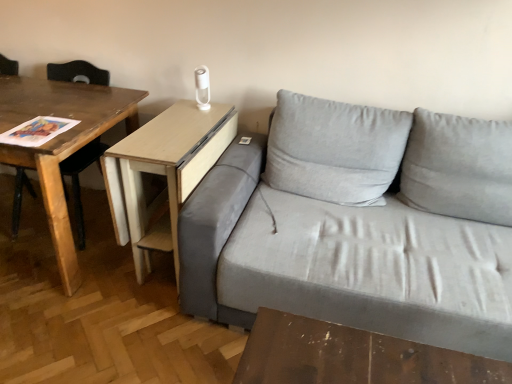
Describe the element at coordinates (163, 173) in the screenshot. Image resolution: width=512 pixels, height=384 pixels. I see `light wood/woodenobject at center, which appears as the second table when viewed from the left` at that location.

Locate an element on the screen. The height and width of the screenshot is (384, 512). gray fabric couch at center is located at coordinates (359, 225).

Where is `light wood/woodenobject at center, which ranks as the first table in right-to-left order`? The height and width of the screenshot is (384, 512). light wood/woodenobject at center, which ranks as the first table in right-to-left order is located at coordinates (163, 173).

Identify the location of studio couch on the right of wooden table at left, which is the 1th table in left-to-right order. (359, 225).

Between wooden table at left, arranged as the 2th table when viewed from the right, and gray fabric couch at center, which one appears on the left side from the viewer's perspective?

From the viewer's perspective, wooden table at left, arranged as the 2th table when viewed from the right, appears more on the left side.

Relative to gray fabric couch at center, is wooden table at left, which is the 1th table in left-to-right order, in front or behind?

wooden table at left, which is the 1th table in left-to-right order, is positioned farther from the viewer than gray fabric couch at center.

Looking at their sizes, would you say wooden table at left, arranged as the 2th table when viewed from the right, is wider or thinner than gray fabric couch at center?

wooden table at left, arranged as the 2th table when viewed from the right, is thinner than gray fabric couch at center.

From the image's perspective, is wooden table at left, which is the 1th table in left-to-right order, located above light wood/woodenobject at center, which appears as the second table when viewed from the left?

Yes, from the image's perspective, wooden table at left, which is the 1th table in left-to-right order, is over light wood/woodenobject at center, which appears as the second table when viewed from the left.

Is wooden table at left, arranged as the 2th table when viewed from the right, outside of light wood/woodenobject at center, which appears as the second table when viewed from the left?

Indeed, wooden table at left, arranged as the 2th table when viewed from the right, is completely outside light wood/woodenobject at center, which appears as the second table when viewed from the left.

Does wooden table at left, which is the 1th table in left-to-right order, touch light wood/woodenobject at center, which appears as the second table when viewed from the left?

There is a gap between wooden table at left, which is the 1th table in left-to-right order, and light wood/woodenobject at center, which appears as the second table when viewed from the left.

Is wooden table at left, arranged as the 2th table when viewed from the right, oriented towards light wood/woodenobject at center, which appears as the second table when viewed from the left?

No, wooden table at left, arranged as the 2th table when viewed from the right, is not facing towards light wood/woodenobject at center, which appears as the second table when viewed from the left.

Is light wood/woodenobject at center, which appears as the second table when viewed from the left, directly adjacent to wooden table at left, which is the 1th table in left-to-right order?

No.

There is a light wood/woodenobject at center, which appears as the second table when viewed from the left. Identify the location of table above it (from a real-world perspective). This screenshot has width=512, height=384. (61, 144).

Does light wood/woodenobject at center, which appears as the second table when viewed from the left, come behind wooden table at left, arranged as the 2th table when viewed from the right?

Yes, light wood/woodenobject at center, which appears as the second table when viewed from the left, is further from the viewer.

Is light wood/woodenobject at center, which ranks as the first table in right-to-left order, positioned beyond the bounds of wooden table at left, which is the 1th table in left-to-right order?

light wood/woodenobject at center, which ranks as the first table in right-to-left order, lies outside wooden table at left, which is the 1th table in left-to-right order,'s area.

Which of these two, light wood/woodenobject at center, which appears as the second table when viewed from the left, or gray fabric couch at center, is wider?

With larger width is gray fabric couch at center.

What's the angular difference between light wood/woodenobject at center, which ranks as the first table in right-to-left order, and gray fabric couch at center's facing directions?

The facing directions of light wood/woodenobject at center, which ranks as the first table in right-to-left order, and gray fabric couch at center are 0.497 degrees apart.

Does light wood/woodenobject at center, which appears as the second table when viewed from the left, have a larger size compared to gray fabric couch at center?

No, light wood/woodenobject at center, which appears as the second table when viewed from the left, is not bigger than gray fabric couch at center.

Is the depth of light wood/woodenobject at center, which ranks as the first table in right-to-left order, less than that of gray fabric couch at center?

No, light wood/woodenobject at center, which ranks as the first table in right-to-left order, is further to the viewer.

The height and width of the screenshot is (384, 512). What are the coordinates of `studio couch that appears above the wooden table at left, arranged as the 2th table when viewed from the right (from a real-world perspective)` in the screenshot? It's located at (359, 225).

Is gray fabric couch at center to the right of wooden table at left, which is the 1th table in left-to-right order, from the viewer's perspective?

Yes.

Between gray fabric couch at center and wooden table at left, arranged as the 2th table when viewed from the right, which one has larger size?

Bigger between the two is gray fabric couch at center.

Between gray fabric couch at center and wooden table at left, arranged as the 2th table when viewed from the right, which one is positioned behind?

wooden table at left, arranged as the 2th table when viewed from the right, is further from the camera.

From a real-world perspective, between gray fabric couch at center and light wood/woodenobject at center, which appears as the second table when viewed from the left, who is vertically higher?

gray fabric couch at center is physically above.

Is there a large distance between gray fabric couch at center and light wood/woodenobject at center, which ranks as the first table in right-to-left order?

No, there isn't a large distance between gray fabric couch at center and light wood/woodenobject at center, which ranks as the first table in right-to-left order.

Is point (190, 215) behind point (220, 152)?

No, (190, 215) is closer to viewer.

What's the angular difference between gray fabric couch at center and light wood/woodenobject at center, which ranks as the first table in right-to-left order,'s facing directions?

0.497 degrees separate the facing orientations of gray fabric couch at center and light wood/woodenobject at center, which ranks as the first table in right-to-left order.

Find the location of a particular element. studio couch that appears above the wooden table at left, arranged as the 2th table when viewed from the right (from a real-world perspective) is located at coordinates (359, 225).

The width and height of the screenshot is (512, 384). Find the location of `table on the left side of light wood/woodenobject at center, which appears as the second table when viewed from the left`. table on the left side of light wood/woodenobject at center, which appears as the second table when viewed from the left is located at coordinates (61, 144).

When comparing their distances from light wood/woodenobject at center, which appears as the second table when viewed from the left, does wooden table at left, arranged as the 2th table when viewed from the right, or gray fabric couch at center seem further?

gray fabric couch at center.

Looking at the image, which one is located further to light wood/woodenobject at center, which ranks as the first table in right-to-left order, gray fabric couch at center or wooden table at left, arranged as the 2th table when viewed from the right?

Based on the image, gray fabric couch at center appears to be further to light wood/woodenobject at center, which ranks as the first table in right-to-left order.

From the image, which object appears to be nearer to gray fabric couch at center, light wood/woodenobject at center, which ranks as the first table in right-to-left order, or wooden table at left, arranged as the 2th table when viewed from the right?

The object closer to gray fabric couch at center is light wood/woodenobject at center, which ranks as the first table in right-to-left order.

Estimate the real-world distances between objects in this image. Which object is further from wooden table at left, arranged as the 2th table when viewed from the right, gray fabric couch at center or light wood/woodenobject at center, which appears as the second table when viewed from the left?

gray fabric couch at center is further to wooden table at left, arranged as the 2th table when viewed from the right.

From the image, which object appears to be nearer to wooden table at left, which is the 1th table in left-to-right order, light wood/woodenobject at center, which ranks as the first table in right-to-left order, or gray fabric couch at center?

light wood/woodenobject at center, which ranks as the first table in right-to-left order, is positioned closer to the anchor wooden table at left, which is the 1th table in left-to-right order.

Estimate the real-world distances between objects in this image. Which object is closer to gray fabric couch at center, wooden table at left, arranged as the 2th table when viewed from the right, or light wood/woodenobject at center, which appears as the second table when viewed from the left?

light wood/woodenobject at center, which appears as the second table when viewed from the left.

Identify the location of table between wooden table at left, which is the 1th table in left-to-right order, and gray fabric couch at center. The height and width of the screenshot is (384, 512). coord(163,173).